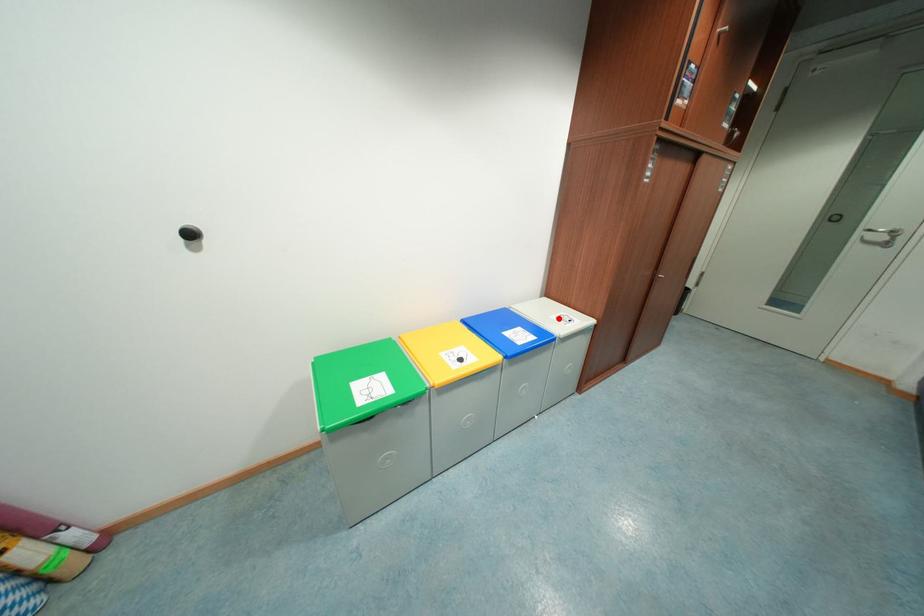
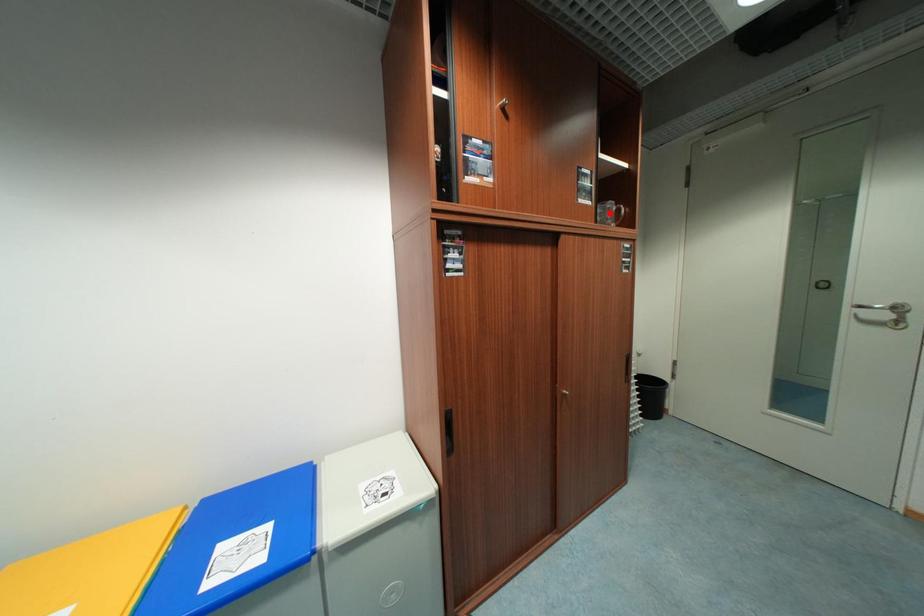
I am providing you with two images of the same scene from different viewpoints. A red point is marked on the first image and another point is marked on the second image. Is the marked point in image1 the same physical position as the marked point in image2?

No